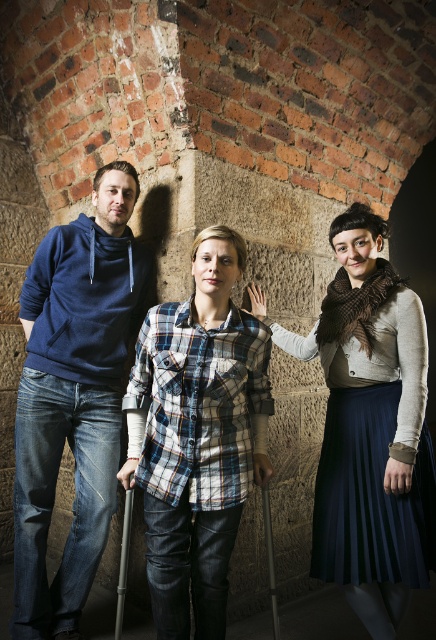
You are a photographer setting up a tripod to take a group photo of the three people. The tripod has a height limit of 1.7 meters. The plaid shirt at center and the black plastic crutch at center are both in the frame. Which object is more likely to exceed the tripod height limit?

The plaid shirt at center is taller than the black plastic crutch at center, so the plaid shirt at center is more likely to exceed the tripod height limit of 1.7 meters.